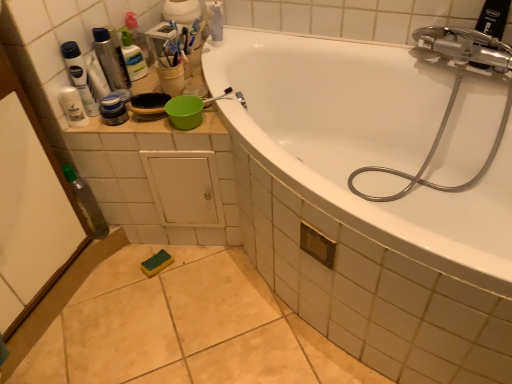
Question: Considering the relative sizes of transparent plastic bottle at left and white glossy mouthwash at upper left in the image provided, is transparent plastic bottle at left bigger than white glossy mouthwash at upper left?

Choices:
 (A) no
 (B) yes

Answer: (B)

Question: Could you tell me if transparent plastic bottle at left is turned towards white glossy mouthwash at upper left?

Choices:
 (A) yes
 (B) no

Answer: (B)

Question: From a real-world perspective, is transparent plastic bottle at left under white glossy mouthwash at upper left?

Choices:
 (A) no
 (B) yes

Answer: (B)

Question: From the image's perspective, is transparent plastic bottle at left on white glossy mouthwash at upper left?

Choices:
 (A) yes
 (B) no

Answer: (B)

Question: Is white glossy mouthwash at upper left surrounded by transparent plastic bottle at left?

Choices:
 (A) no
 (B) yes

Answer: (A)

Question: Can you confirm if transparent plastic bottle at left is thinner than white glossy mouthwash at upper left?

Choices:
 (A) yes
 (B) no

Answer: (B)

Question: Does transparent plastic bottle at left have a greater width compared to matte black jar at upper left, acting as the 3th toiletry starting from the top?

Choices:
 (A) no
 (B) yes

Answer: (B)

Question: Can you confirm if transparent plastic bottle at left is bigger than matte black jar at upper left, acting as the 3th toiletry starting from the top?

Choices:
 (A) yes
 (B) no

Answer: (A)

Question: Does transparent plastic bottle at left have a lesser width compared to matte black jar at upper left, which is the first toiletry in bottom-to-top order?

Choices:
 (A) no
 (B) yes

Answer: (A)

Question: Is the position of transparent plastic bottle at left more distant than that of matte black jar at upper left, which is the first toiletry in bottom-to-top order?

Choices:
 (A) yes
 (B) no

Answer: (A)

Question: Would you say transparent plastic bottle at left is outside matte black jar at upper left, which is the first toiletry in bottom-to-top order?

Choices:
 (A) no
 (B) yes

Answer: (B)

Question: Does transparent plastic bottle at left have a smaller size compared to matte black jar at upper left, acting as the 3th toiletry starting from the top?

Choices:
 (A) no
 (B) yes

Answer: (A)

Question: Is the depth of silver metallic hose at upper right greater than that of white glossy mouthwash at upper left?

Choices:
 (A) no
 (B) yes

Answer: (A)